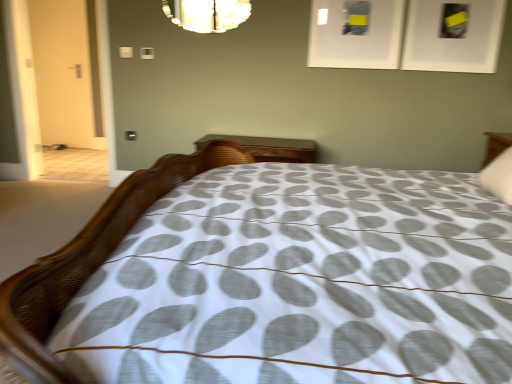
Question: Can you confirm if white soft pillow at upper right is taller than shiny glass mirror at upper center?

Choices:
 (A) yes
 (B) no

Answer: (B)

Question: Does white soft pillow at upper right appear on the left side of shiny glass mirror at upper center?

Choices:
 (A) yes
 (B) no

Answer: (B)

Question: Would you say shiny glass mirror at upper center is part of white soft pillow at upper right's contents?

Choices:
 (A) yes
 (B) no

Answer: (B)

Question: Does white soft pillow at upper right come behind shiny glass mirror at upper center?

Choices:
 (A) no
 (B) yes

Answer: (A)

Question: Would you say white soft pillow at upper right is outside shiny glass mirror at upper center?

Choices:
 (A) no
 (B) yes

Answer: (B)

Question: Can you confirm if white soft pillow at upper right is thinner than shiny glass mirror at upper center?

Choices:
 (A) yes
 (B) no

Answer: (B)

Question: From the image's perspective, is white matte picture frame at upper right, positioned as the first picture frame in right-to-left order, over white matte picture frame at upper center, arranged as the 2th picture frame when viewed from the right?

Choices:
 (A) no
 (B) yes

Answer: (A)

Question: Is white matte picture frame at upper right, positioned as the first picture frame in right-to-left order, completely or partially outside of white matte picture frame at upper center, arranged as the 2th picture frame when viewed from the right?

Choices:
 (A) no
 (B) yes

Answer: (B)

Question: Does white matte picture frame at upper right, positioned as the first picture frame in right-to-left order, have a lesser width compared to white matte picture frame at upper center, arranged as the 2th picture frame when viewed from the right?

Choices:
 (A) yes
 (B) no

Answer: (B)

Question: From a real-world perspective, does white matte picture frame at upper right, the 2th picture frame positioned from the left, stand above white matte picture frame at upper center, the 1th picture frame from the left?

Choices:
 (A) no
 (B) yes

Answer: (B)

Question: Can you confirm if white matte picture frame at upper right, positioned as the first picture frame in right-to-left order, is taller than white matte picture frame at upper center, arranged as the 2th picture frame when viewed from the right?

Choices:
 (A) yes
 (B) no

Answer: (A)

Question: Could you tell me if white matte picture frame at upper right, positioned as the first picture frame in right-to-left order, is facing white matte picture frame at upper center, arranged as the 2th picture frame when viewed from the right?

Choices:
 (A) no
 (B) yes

Answer: (A)

Question: Considering the relative sizes of white soft pillow at upper right and white textured bed at center in the image provided, is white soft pillow at upper right bigger than white textured bed at center?

Choices:
 (A) yes
 (B) no

Answer: (B)